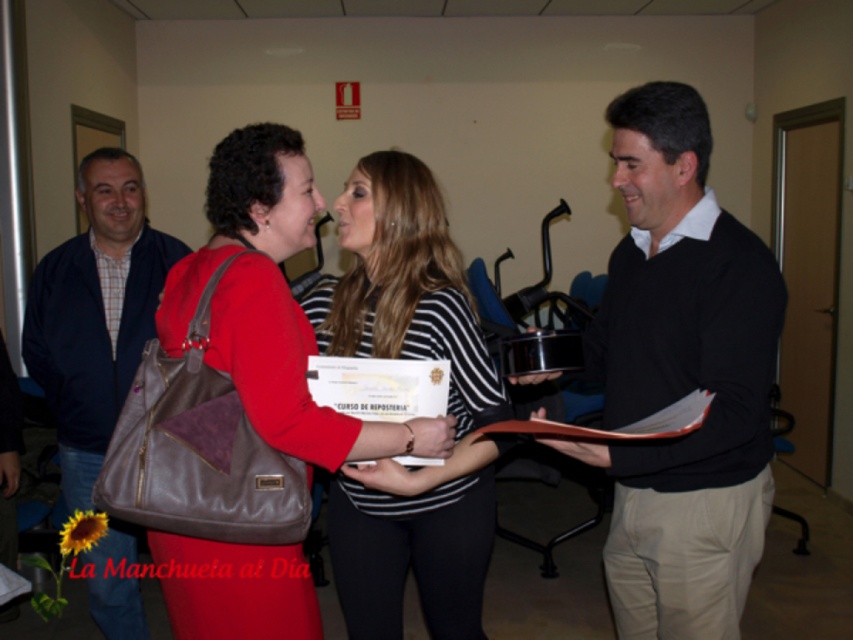
Question: Can you confirm if striped fabric shirt at center is wider than matte brown bag at center?

Choices:
 (A) yes
 (B) no

Answer: (B)

Question: Is striped fabric shirt at center to the right of matte brown bag at center from the viewer's perspective?

Choices:
 (A) no
 (B) yes

Answer: (B)

Question: Which of these objects is positioned closest to the striped fabric shirt at center?

Choices:
 (A) black sweater at center
 (B) dark blue jacket at left
 (C) matte brown bag at center

Answer: (C)

Question: Where is black sweater at center located in relation to matte brown bag at center in the image?

Choices:
 (A) below
 (B) above

Answer: (A)

Question: Which point is farther from the camera taking this photo?

Choices:
 (A) (105, 192)
 (B) (183, 278)

Answer: (A)

Question: Among these objects, which one is farthest from the camera?

Choices:
 (A) matte brown bag at center
 (B) black sweater at center
 (C) striped fabric shirt at center

Answer: (C)